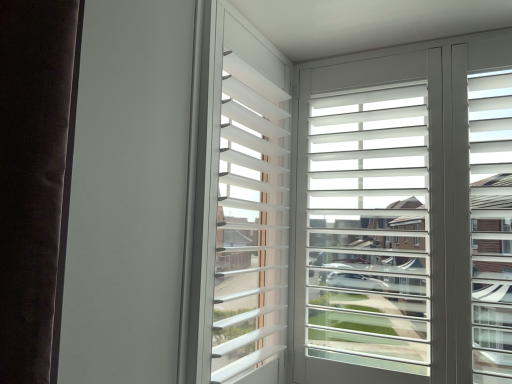
Measure the distance between point (362,117) and camera.

The distance of point (362,117) from camera is 4.55 feet.

Locate an element on the screen. Image resolution: width=512 pixels, height=384 pixels. white matte window screen at upper right is located at coordinates (362, 223).

What do you see at coordinates (362, 223) in the screenshot?
I see `white matte window screen at upper right` at bounding box center [362, 223].

In order to face white matte blinds at center, should I rotate leftwards or rightwards?

Turn left by 0.847 degrees to look at white matte blinds at center.

This screenshot has height=384, width=512. What do you see at coordinates (243, 205) in the screenshot?
I see `white matte blinds at center` at bounding box center [243, 205].

I want to click on white matte blinds at center, so click(243, 205).

This screenshot has width=512, height=384. In order to click on white matte window screen at upper right in this screenshot , I will do `click(362, 223)`.

Which object is positioned more to the left, white matte window screen at upper right or white matte blinds at center?

From the viewer's perspective, white matte blinds at center appears more on the left side.

Which object is closer to the camera taking this photo, white matte window screen at upper right or white matte blinds at center?

Positioned in front is white matte blinds at center.

Which is less distant, (406, 346) or (244, 247)?

The point (244, 247) is closer.

From the image's perspective, does white matte window screen at upper right appear higher than white matte blinds at center?

No, from the image's perspective, white matte window screen at upper right is not above white matte blinds at center.

From a real-world perspective, between white matte window screen at upper right and white matte blinds at center, who is vertically higher?

white matte blinds at center is physically above.

Looking at their sizes, would you say white matte window screen at upper right is wider or thinner than white matte blinds at center?

Considering their sizes, white matte window screen at upper right looks slimmer than white matte blinds at center.

Considering the sizes of objects white matte window screen at upper right and white matte blinds at center in the image provided, who is shorter, white matte window screen at upper right or white matte blinds at center?

With less height is white matte blinds at center.

Is white matte window screen at upper right smaller than white matte blinds at center?

No.

In the scene shown: Is white matte window screen at upper right located outside white matte blinds at center?

Yes, white matte window screen at upper right is located beyond the bounds of white matte blinds at center.

Is white matte window screen at upper right directly adjacent to white matte blinds at center?

No, white matte window screen at upper right is not with white matte blinds at center.

Could you tell me if white matte window screen at upper right is facing white matte blinds at center?

Yes, white matte window screen at upper right is aimed at white matte blinds at center.

Can you tell me how much white matte window screen at upper right and white matte blinds at center differ in facing direction?

They differ by 92.4 degrees in their facing directions.

How distant is white matte window screen at upper right from white matte blinds at center?

white matte window screen at upper right and white matte blinds at center are 10.40 inches apart.

In the image, there is a white matte blinds at center. Where is `window screen below it (from a real-world perspective)`? window screen below it (from a real-world perspective) is located at coordinates (362, 223).

Considering the relative positions of white matte blinds at center and white matte window screen at upper right in the image provided, is white matte blinds at center to the left of white matte window screen at upper right from the viewer's perspective?

Yes, white matte blinds at center is to the left of white matte window screen at upper right.

Based on the photo, is white matte blinds at center in front of or behind white matte window screen at upper right in the image?

Clearly, white matte blinds at center is in front of white matte window screen at upper right.

Is point (218, 27) positioned behind point (399, 235)?

That is False.

From the image's perspective, is white matte blinds at center above or below white matte window screen at upper right?

Based on their image positions, white matte blinds at center is located above white matte window screen at upper right.

From a real-world perspective, does white matte blinds at center stand above white matte window screen at upper right?

Yes.

Which object is thinner, white matte blinds at center or white matte window screen at upper right?

white matte window screen at upper right is thinner.

Does white matte blinds at center have a greater height compared to white matte window screen at upper right?

Incorrect, the height of white matte blinds at center is not larger of that of white matte window screen at upper right.

Considering the sizes of objects white matte blinds at center and white matte window screen at upper right in the image provided, who is smaller, white matte blinds at center or white matte window screen at upper right?

With smaller size is white matte blinds at center.

Is white matte blinds at center not within white matte window screen at upper right?

Yes, white matte blinds at center is outside of white matte window screen at upper right.

Is white matte blinds at center touching white matte window screen at upper right?

No, white matte blinds at center is not touching white matte window screen at upper right.

Does white matte blinds at center turn towards white matte window screen at upper right?

Yes, white matte blinds at center is turned towards white matte window screen at upper right.

How different are the orientations of white matte blinds at center and white matte window screen at upper right in degrees?

There is a 92.4-degree angle between the facing directions of white matte blinds at center and white matte window screen at upper right.

How much distance is there between white matte blinds at center and white matte window screen at upper right?

white matte blinds at center is 10.40 inches from white matte window screen at upper right.

Find the location of a particular element. The width and height of the screenshot is (512, 384). window screen located behind the white matte blinds at center is located at coordinates (362, 223).

In the image, there is a white matte blinds at center. Identify the location of window screen below it (from the image's perspective). This screenshot has width=512, height=384. (362, 223).

Identify the location of bay window on the left of white matte window screen at upper right. Image resolution: width=512 pixels, height=384 pixels. (243, 205).